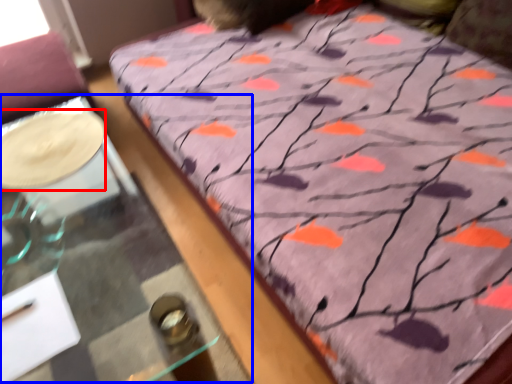
Question: Which object is closer to the camera taking this photo, glass plate (highlighted by a red box) or table (highlighted by a blue box)?

Choices:
 (A) glass plate
 (B) table

Answer: (B)